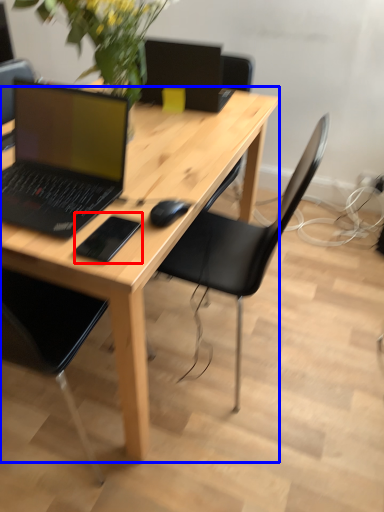
Question: Which object appears closest to the camera in this image, mousepad (highlighted by a red box) or desk (highlighted by a blue box)?

Choices:
 (A) mousepad
 (B) desk

Answer: (B)